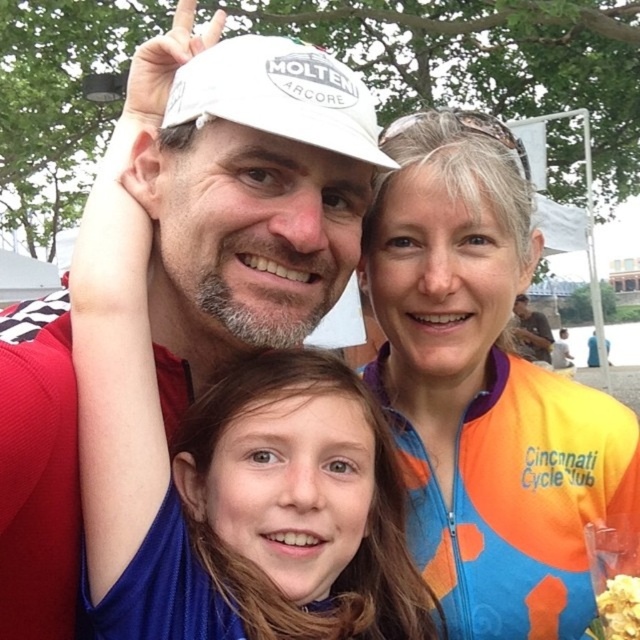
Question: Does orange printed jersey at center have a lesser width compared to white matte cap at upper center?

Choices:
 (A) no
 (B) yes

Answer: (B)

Question: Among these objects, which one is nearest to the camera?

Choices:
 (A) white matte cap at upper center
 (B) white matte baseball cap at upper center

Answer: (A)

Question: Is orange printed jersey at center thinner than crunchy popcorn at lower right?

Choices:
 (A) yes
 (B) no

Answer: (B)

Question: Among these objects, which one is farthest from the camera?

Choices:
 (A) white matte baseball cap at upper center
 (B) white matte cap at upper center
 (C) crunchy popcorn at lower right
 (D) orange printed jersey at center

Answer: (D)

Question: Which point is closer to the camera?

Choices:
 (A) crunchy popcorn at lower right
 (B) orange printed jersey at center

Answer: (A)

Question: Can you confirm if white matte cap at upper center is smaller than crunchy popcorn at lower right?

Choices:
 (A) no
 (B) yes

Answer: (A)